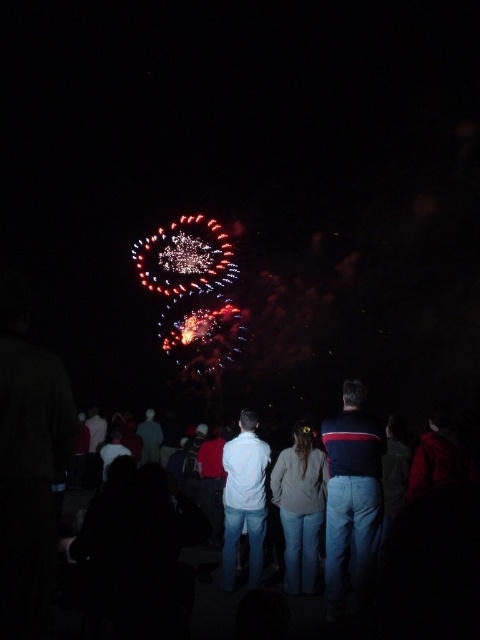
Question: Which point is closer to the camera?

Choices:
 (A) jeans at center
 (B) white matte shirt at center
 (C) dark blue striped sweater at center

Answer: (A)

Question: Which object is farther from the camera taking this photo?

Choices:
 (A) dark blue striped sweater at center
 (B) white matte shirt at center
 (C) denim jeans at center
 (D) jeans at center

Answer: (B)

Question: Which object is the closest to the denim jeans at center?

Choices:
 (A) white matte shirt at center
 (B) dark blue striped sweater at center

Answer: (B)

Question: In this image, where is dark blue striped sweater at center located relative to white matte shirt at center?

Choices:
 (A) below
 (B) above

Answer: (B)

Question: Does dark blue striped sweater at center appear under denim jeans at center?

Choices:
 (A) yes
 (B) no

Answer: (B)

Question: Is the position of jeans at center less distant than that of white matte shirt at center?

Choices:
 (A) no
 (B) yes

Answer: (B)